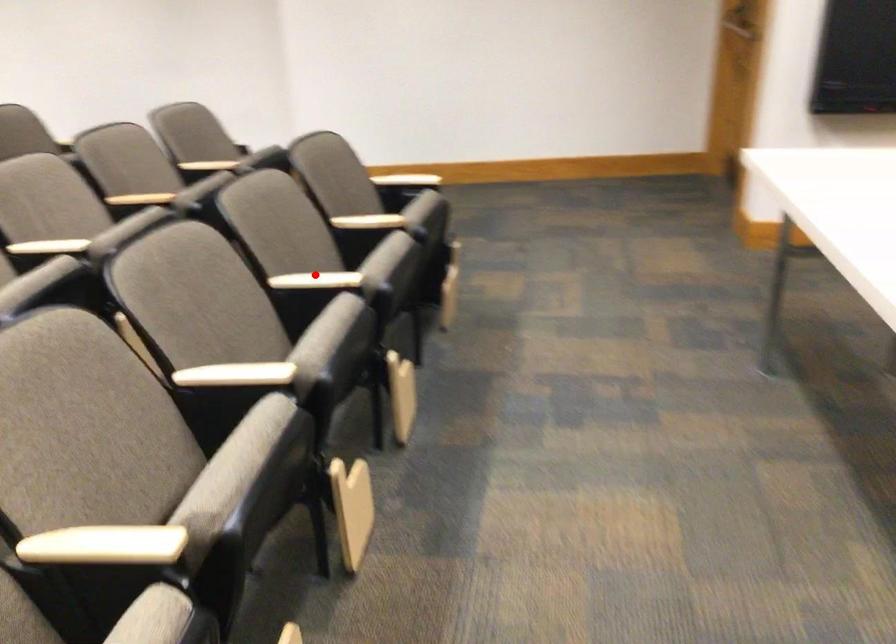
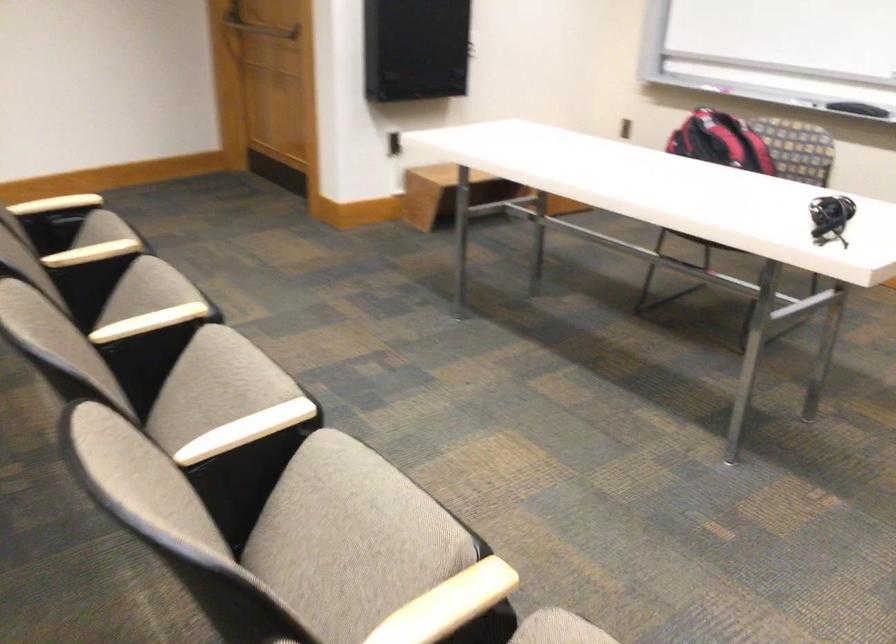
The point at the highlighted location is marked in the first image. Where is the corresponding point in the second image?

(149, 322)